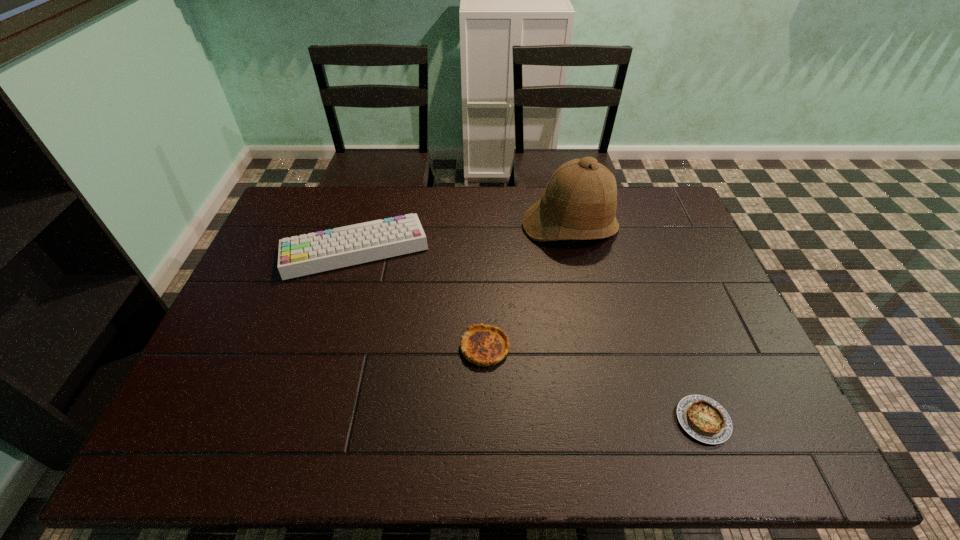
Image resolution: width=960 pixels, height=540 pixels. I want to click on free point at the left edge, so click(240, 296).

Identify the location of blank space at the right edge. (753, 360).

At what (x,y) coordinates should I click in order to perform the action: click on free point between the right quiche and the hat. Please return your answer as a coordinate pair (x, y). The width and height of the screenshot is (960, 540). Looking at the image, I should click on (636, 323).

I want to click on vacant region between the third farthest object and the computer keyboard, so click(x=420, y=298).

Find the location of a particular element. vacant area that lies between the shorter quiche and the computer keyboard is located at coordinates (529, 334).

This screenshot has height=540, width=960. In order to click on vacant area that lies between the hat and the computer keyboard in this screenshot , I will do `click(463, 238)`.

The width and height of the screenshot is (960, 540). What are the coordinates of `vacant area between the left quiche and the shortest object` in the screenshot? It's located at (593, 384).

The width and height of the screenshot is (960, 540). I want to click on vacant region between the tallest object and the second object from left to right, so click(527, 287).

Identify the location of free spot between the computer keyboard and the tallest object. This screenshot has height=540, width=960. (463, 238).

Locate an element on the screen. The width and height of the screenshot is (960, 540). free space between the second shortest object and the nearer quiche is located at coordinates (593, 384).